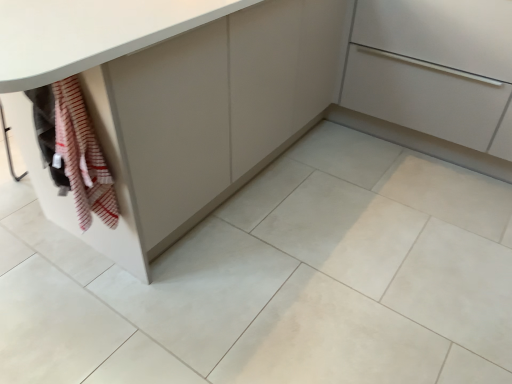
Question: Which direction should I rotate to face matte white cabinet at center, the 2th cabinetry viewed from the left, — up or down?

Choices:
 (A) down
 (B) up

Answer: (B)

Question: Is matte gray cabinet at lower left, acting as the second cabinetry starting from the right, far from striped cotton towel at lower left?

Choices:
 (A) no
 (B) yes

Answer: (A)

Question: Can you confirm if matte gray cabinet at lower left, acting as the second cabinetry starting from the right, is positioned to the right of striped cotton towel at lower left?

Choices:
 (A) no
 (B) yes

Answer: (B)

Question: Can we say matte gray cabinet at lower left, acting as the second cabinetry starting from the right, lies outside striped cotton towel at lower left?

Choices:
 (A) no
 (B) yes

Answer: (B)

Question: Is matte gray cabinet at lower left, the 1th cabinetry viewed from the left, with striped cotton towel at lower left?

Choices:
 (A) yes
 (B) no

Answer: (B)

Question: Does matte gray cabinet at lower left, the 1th cabinetry viewed from the left, turn towards striped cotton towel at lower left?

Choices:
 (A) yes
 (B) no

Answer: (A)

Question: Is matte gray cabinet at lower left, acting as the second cabinetry starting from the right, bigger than striped cotton towel at lower left?

Choices:
 (A) yes
 (B) no

Answer: (A)

Question: Does white glossy tile at lower left appear on the right side of striped cotton towel at lower left?

Choices:
 (A) yes
 (B) no

Answer: (B)

Question: Does white glossy tile at lower left have a smaller size compared to striped cotton towel at lower left?

Choices:
 (A) yes
 (B) no

Answer: (A)

Question: Is white glossy tile at lower left bigger than striped cotton towel at lower left?

Choices:
 (A) yes
 (B) no

Answer: (B)

Question: Can you confirm if white glossy tile at lower left is taller than striped cotton towel at lower left?

Choices:
 (A) no
 (B) yes

Answer: (A)

Question: Is white glossy tile at lower left positioned behind striped cotton towel at lower left?

Choices:
 (A) yes
 (B) no

Answer: (A)

Question: Would you say white glossy tile at lower left contains striped cotton towel at lower left?

Choices:
 (A) no
 (B) yes

Answer: (A)

Question: Does matte gray cabinet at lower left, the 1th cabinetry viewed from the left, come behind matte white cabinet at center, the 2th cabinetry viewed from the left?

Choices:
 (A) no
 (B) yes

Answer: (A)